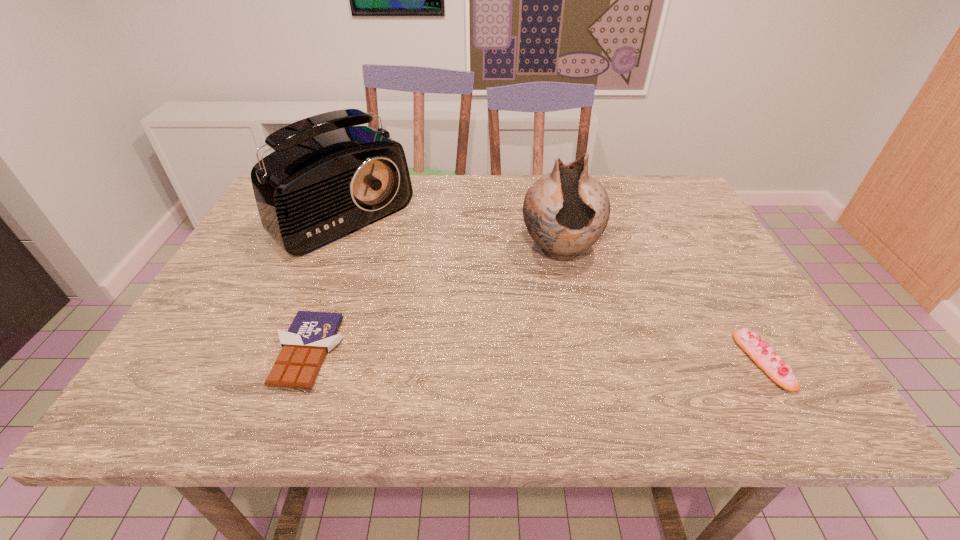
At what (x,y) coordinates should I click in order to perform the action: click on free space at the near edge of the desktop. Please return your answer as a coordinate pair (x, y). Looking at the image, I should click on (527, 360).

Where is `vacant space at the left edge of the desktop`? vacant space at the left edge of the desktop is located at coordinates (200, 321).

You are a GUI agent. You are given a task and a screenshot of the screen. Output one action in this format:
    pyautogui.click(x=<x>, y=<y>)
    Task: Click on the blank space at the far right corner
    Image resolution: width=960 pixels, height=540 pixels.
    Given the screenshot: What is the action you would take?
    pyautogui.click(x=635, y=179)

In order to click on vacant region at the near right corner of the desktop in this screenshot , I will do point(726,341).

At what (x,y) coordinates should I click in order to perform the action: click on vacant region between the eclair and the radio receiver. Please return your answer as a coordinate pair (x, y). The height and width of the screenshot is (540, 960). Looking at the image, I should click on (550, 287).

Identify the location of free space between the third tallest object and the radio receiver. (550, 287).

This screenshot has width=960, height=540. What are the coordinates of `blank region between the shortest object and the eclair` in the screenshot? It's located at (536, 356).

Find the location of `free space between the third object from left to right and the rightmost object`. free space between the third object from left to right and the rightmost object is located at coordinates [x=661, y=306].

You are a GUI agent. You are given a task and a screenshot of the screen. Output one action in this format:
    pyautogui.click(x=<x>, y=<y>)
    Task: Click on the unoccupied area between the second object from right to left and the radio receiver
    
    Given the screenshot: What is the action you would take?
    pyautogui.click(x=448, y=232)

This screenshot has height=540, width=960. I want to click on free spot between the chocolate bar and the third object from left to right, so 434,301.